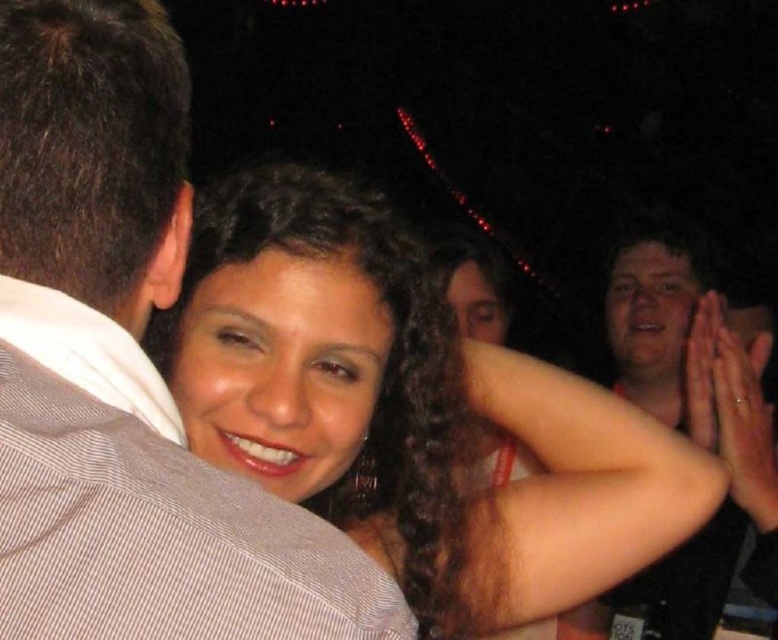
Looking at this image, where is the white striped shirt at left located in the image?

The white striped shirt at left is located at point 0.577 on the x axis and 0.163 on the y axis.

You are at a party and want to take a photo of two points in the scene. The first point is at coordinate point(268, 531) and the second is at point(619, 593). Which point is closer to the camera?

Point(268, 531) is closer to the camera than point(619, 593).